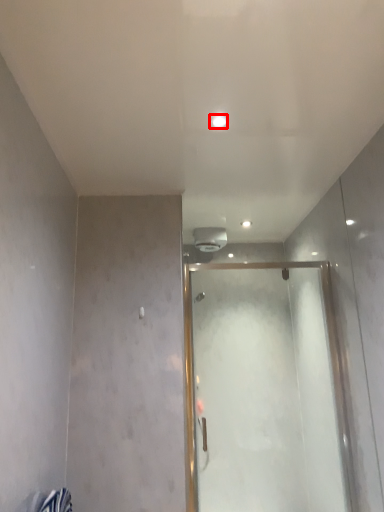
Question: From the image's perspective, where is light (annotated by the red box) located relative to glass door?

Choices:
 (A) above
 (B) below

Answer: (A)